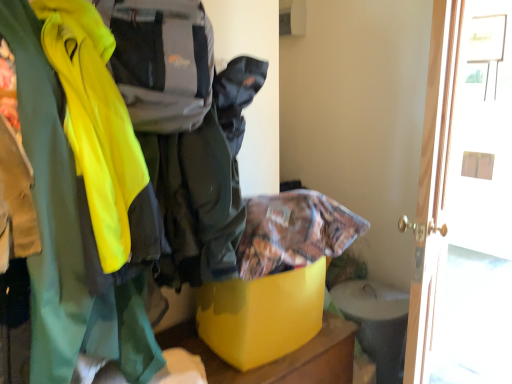
Question: Does white glossy door at right have a greater width compared to printed fabric bag at center?

Choices:
 (A) yes
 (B) no

Answer: (B)

Question: From the image's perspective, is white glossy door at right located beneath printed fabric bag at center?

Choices:
 (A) yes
 (B) no

Answer: (B)

Question: Is white glossy door at right with printed fabric bag at center?

Choices:
 (A) no
 (B) yes

Answer: (A)

Question: Is printed fabric bag at center at the back of white glossy door at right?

Choices:
 (A) no
 (B) yes

Answer: (A)

Question: Is there a large distance between white glossy door at right and printed fabric bag at center?

Choices:
 (A) no
 (B) yes

Answer: (B)

Question: From a real-world perspective, is white glossy door at right positioned under printed fabric bag at center based on gravity?

Choices:
 (A) no
 (B) yes

Answer: (B)

Question: From a real-world perspective, is yellow plastic storage box at center physically above white glossy door at right?

Choices:
 (A) no
 (B) yes

Answer: (A)

Question: Is yellow plastic storage box at center thinner than white glossy door at right?

Choices:
 (A) no
 (B) yes

Answer: (A)

Question: Is yellow plastic storage box at center to the right of white glossy door at right from the viewer's perspective?

Choices:
 (A) no
 (B) yes

Answer: (A)

Question: Are yellow plastic storage box at center and white glossy door at right located far from each other?

Choices:
 (A) yes
 (B) no

Answer: (B)

Question: Is yellow plastic storage box at center to the left of white glossy door at right from the viewer's perspective?

Choices:
 (A) no
 (B) yes

Answer: (B)

Question: Does yellow plastic storage box at center have a greater height compared to white glossy door at right?

Choices:
 (A) no
 (B) yes

Answer: (A)

Question: Is yellow plastic storage box at center not close to printed fabric bag at center?

Choices:
 (A) no
 (B) yes

Answer: (A)